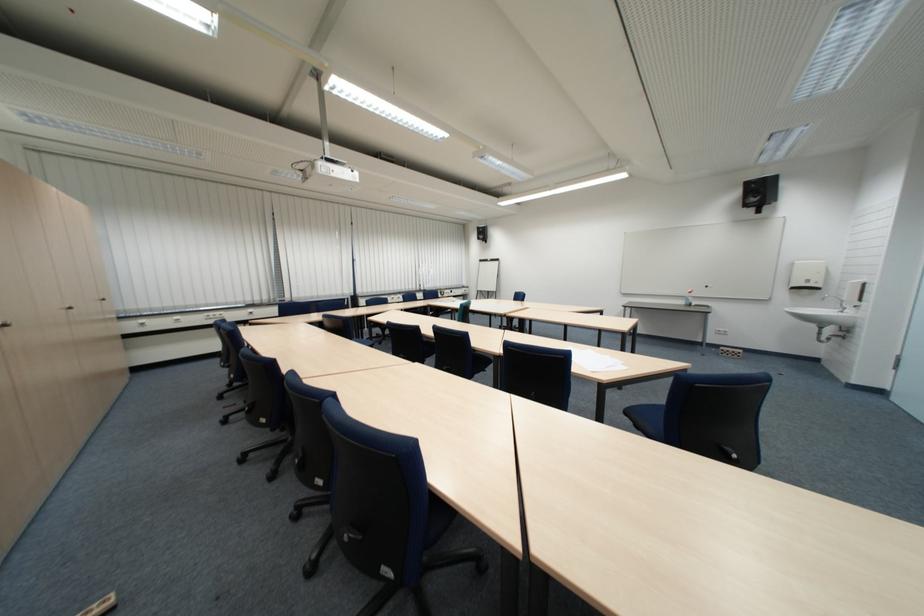
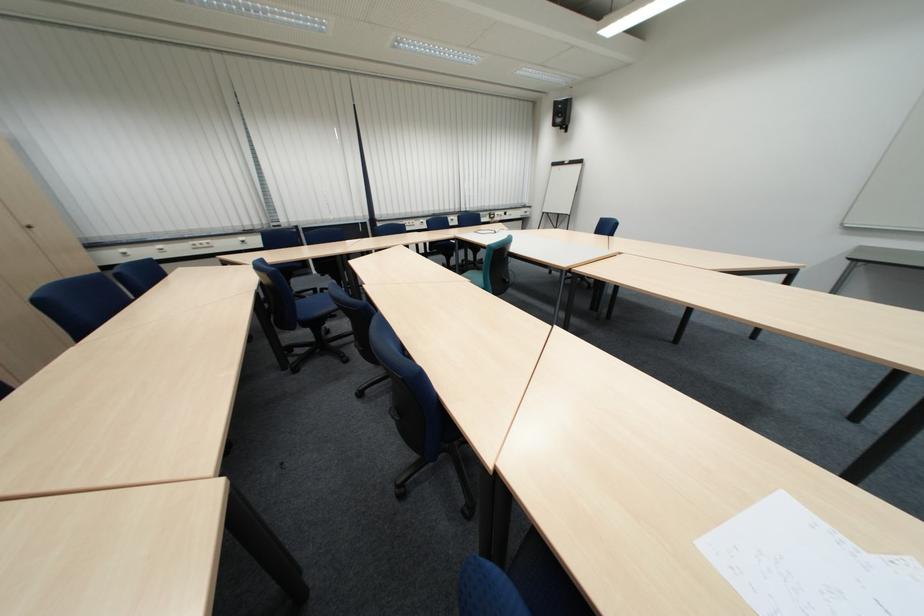
Question: Which direction would the cameraman need to move to produce the second image? Reply with the corresponding letter.

Choices:
 (A) Left
 (B) Right
 (C) Forward
 (D) Backward

Answer: (C)